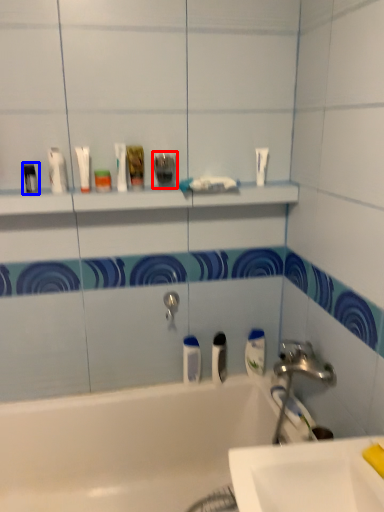
Question: Which object is further to the camera taking this photo, toiletry (highlighted by a red box) or toiletry (highlighted by a blue box)?

Choices:
 (A) toiletry
 (B) toiletry

Answer: (A)